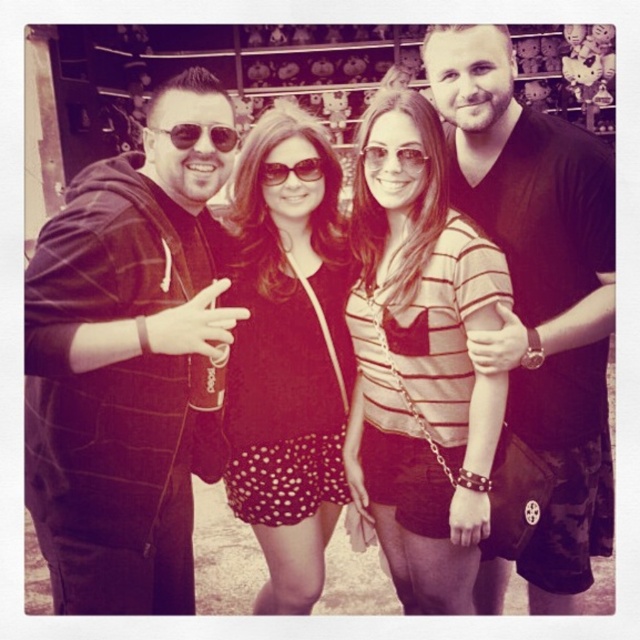
You are planning to take a photo with two friends. You have a black matte shirt at right and sunglasses at center in your frame. Which item is wider?

The sunglasses at center is wider than the black matte shirt at right.

In the photo of the four people, the black textured hoodie at left and the polka dot fabric dress at center are both visible. Which clothing item takes up more horizontal space in the image?

The black textured hoodie at left takes up more horizontal space than the polka dot fabric dress at center because its width surpasses the dress.